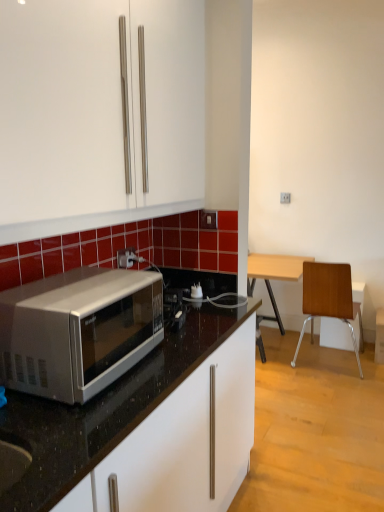
Locate an element on the screen. free space in front of wooden/metallic chair at right is located at coordinates (332, 391).